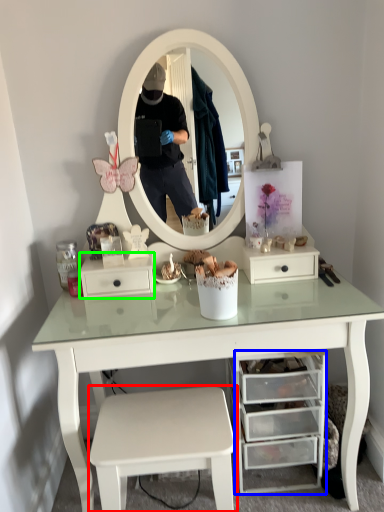
Question: Which is farther away from stool (highlighted by a red box)? drawer (highlighted by a blue box) or drawer (highlighted by a green box)?

Choices:
 (A) drawer
 (B) drawer

Answer: (B)